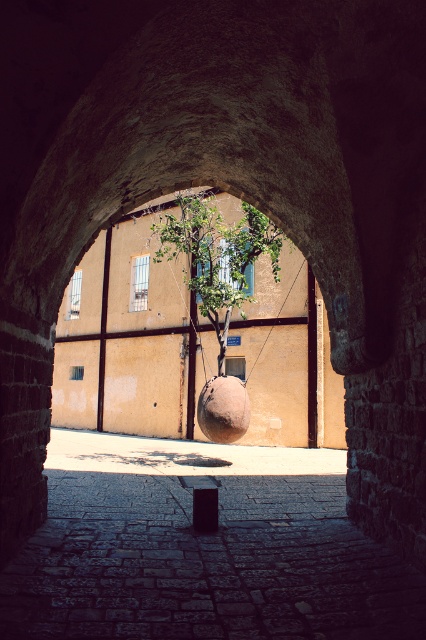
You are standing in front of the stone archway and notice the smooth stone alley at center and the green leafy tree at center. Which one is taller?

The green leafy tree at center is taller than the smooth stone alley at center.

You are standing outside the stone archway and want to walk towards the courtyard. Which object will you encounter first, the smooth stone alley at center or the green leafy tree at center?

The smooth stone alley at center is closer to the viewer than the green leafy tree at center, so you will encounter the smooth stone alley at center first.

You are standing at the entrance of the courtyard looking through the stone archway. There is a point marked at coordinates (201, 548). Based on the scene description, what type of surface is this point located on?

The point (201, 548) is located on the smooth stone alley at center.